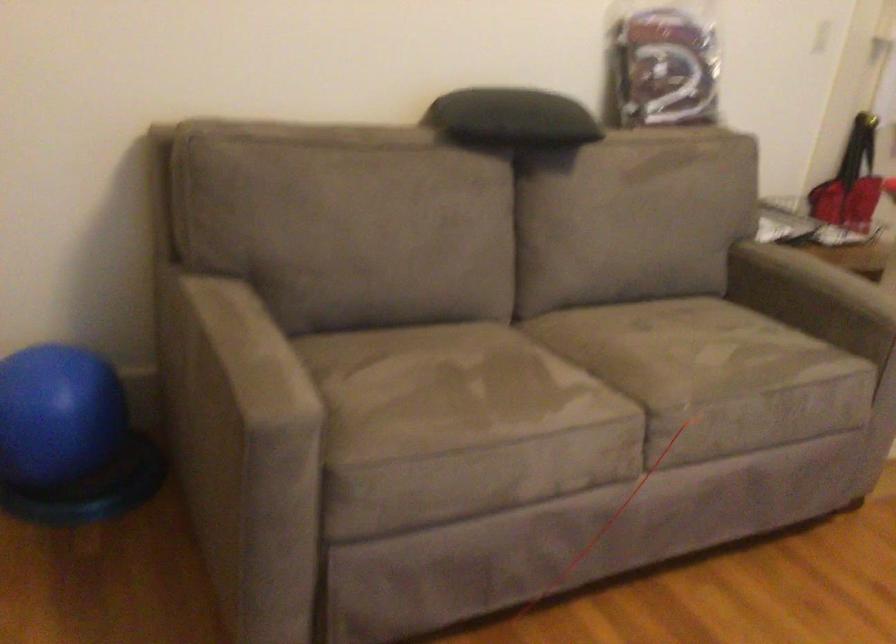
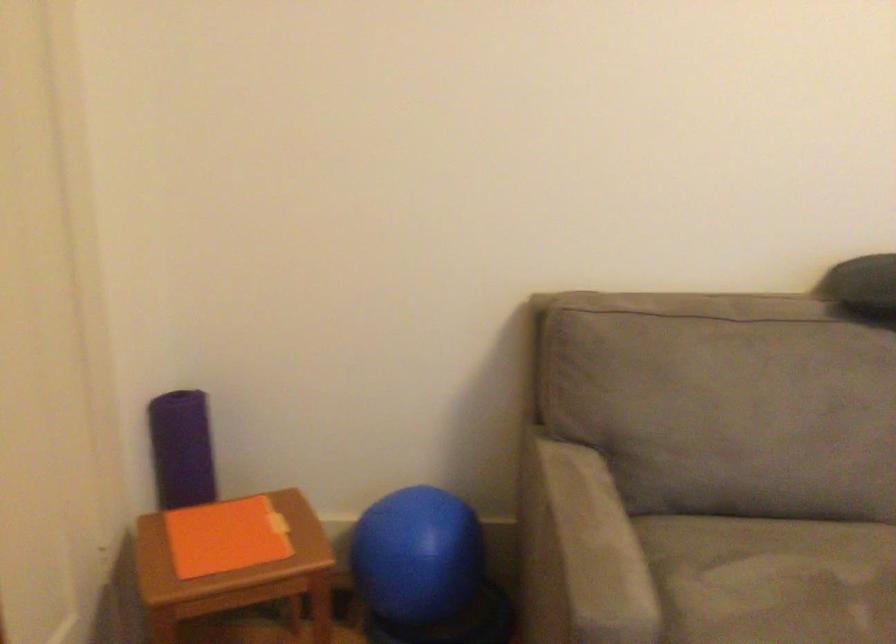
Locate, in the second image, the point that corresponds to (x=409, y=373) in the first image.

(771, 579)